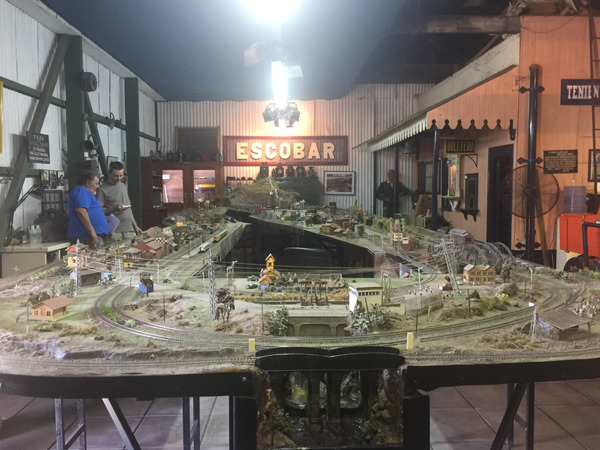
What are the coordinates of `ceiling` in the screenshot? It's located at (211, 77).